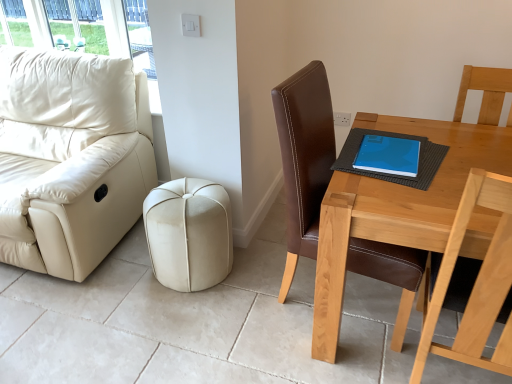
The height and width of the screenshot is (384, 512). Find the location of `space that is in front of blue matte book at upper right`. space that is in front of blue matte book at upper right is located at coordinates (394, 198).